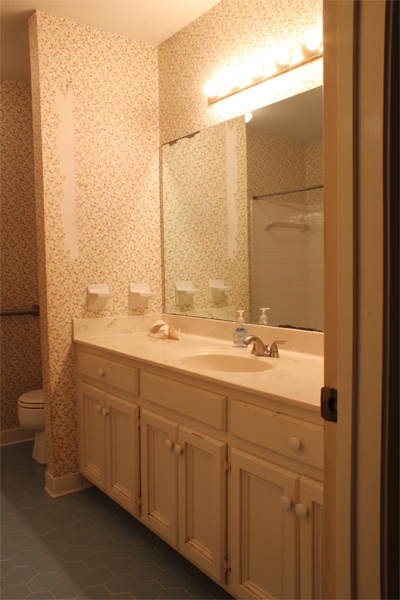
Locate an element on the screen. This screenshot has height=600, width=400. cabinet knobs is located at coordinates (99, 372), (294, 444), (97, 407), (104, 412), (167, 442), (177, 448), (284, 501), (300, 509).